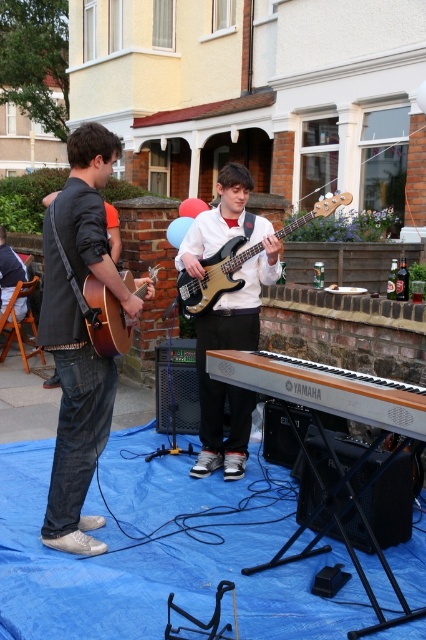
Is the position of denim jeans at left less distant than that of black glossy bass guitar at center?

Yes.

Does denim jeans at left appear on the right side of black glossy bass guitar at center?

No, denim jeans at left is not to the right of black glossy bass guitar at center.

Image resolution: width=426 pixels, height=640 pixels. Find the location of `denim jeans at left`. denim jeans at left is located at coordinates (78, 337).

From the picture: Does shiny black bass guitar at center have a smaller size compared to matte brown acoustic guitar at left?

No.

Does shiny black bass guitar at center have a greater width compared to matte brown acoustic guitar at left?

Yes.

Which is behind, point (245, 333) or point (106, 317)?

Positioned behind is point (245, 333).

You are a GUI agent. You are given a task and a screenshot of the screen. Output one action in this format:
    pyautogui.click(x=<x>, y=<y>)
    Task: Click on the shiny black bass guitar at center
    The image size is (426, 640).
    Given the screenshot: What is the action you would take?
    pyautogui.click(x=227, y=317)

In the scene shown: Does shiny black bass guitar at center appear under black glossy bass guitar at center?

Indeed, shiny black bass guitar at center is positioned under black glossy bass guitar at center.

How much distance is there between shiny black bass guitar at center and black glossy bass guitar at center?

They are 12.88 inches apart.

Which is in front, point (256, 243) or point (184, 300)?

Positioned in front is point (256, 243).

What are the coordinates of `shiny black bass guitar at center` in the screenshot? It's located at (227, 317).